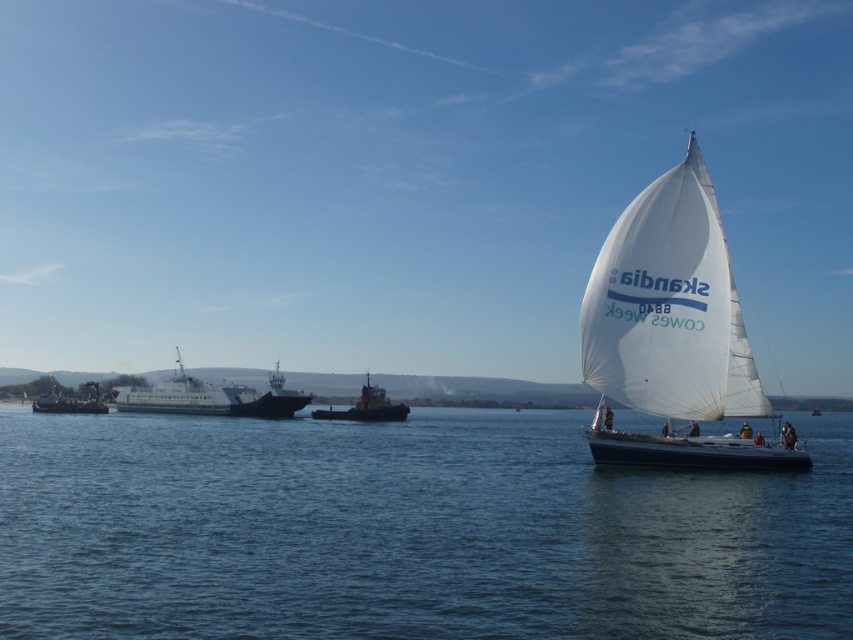
You are a photographer planning to capture the entire scene of the blue water at center and the dark gray metallic ferry at left in one shot. Considering their sizes, which object should you focus on first to ensure both are clearly visible in the frame?

The blue water at center is larger in size than the dark gray metallic ferry at left, so you should focus on the blue water at center first to ensure both objects are clearly visible in the frame.

You are a photographer planning to capture the entire scene of the blue water at center and the white sailboat at right in one shot. Based on their widths, which object should you position closer to the camera to ensure both fit within the frame?

Since the blue water at center is wider than the white sailboat at right, positioning the blue water at center closer to the camera would allow both objects to fit within the frame as it occupies more horizontal space.

You are a maritime observer noting vessel sizes. Which vessel is smaller between the orange metallic tugboat at center and the metallic gray ship at left?

The orange metallic tugboat at center is smaller than the metallic gray ship at left.